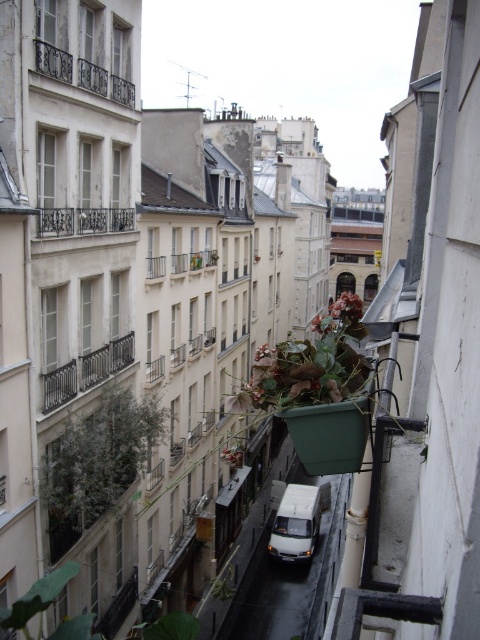
You are standing on the polished metal balcony at upper left and want to park your car below. Is there enough space between the white matte van at center and the buildings to safely park your car?

The white matte van at center is positioned under the polished metal balcony at upper left, but there is no information provided about the space between the van and the buildings. Without knowing the dimensions of the parking area or the size of your car, it is impossible to determine if there is enough space to park safely.

You are a window cleaner standing on a balcony overlooking the narrow urban street. You notice two plants below you. Which of the two plants, the green matte plant at lower left or the green leafy plant at lower center, is smaller in size?

The green matte plant at lower left is smaller in size compared to the green leafy plant at lower center.